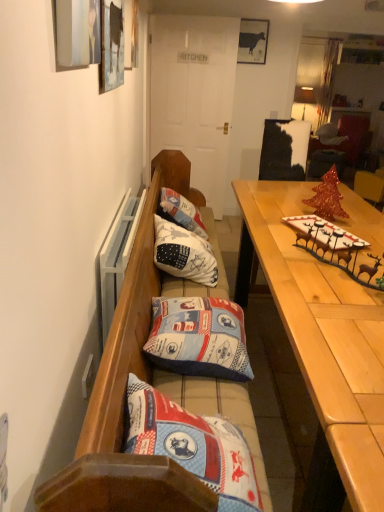
Question: From the image's perspective, is white cotton cushion at center, the first pillow from the back, positioned above or below matte black cow at upper center?

Choices:
 (A) above
 (B) below

Answer: (B)

Question: Looking at the image, does white cotton cushion at center, which appears as the 2th pillow when viewed from the front, seem bigger or smaller compared to matte black cow at upper center?

Choices:
 (A) small
 (B) big

Answer: (B)

Question: Which of these objects is positioned farthest from the matte black cabinet at upper right?

Choices:
 (A) matte black cow at upper center
 (B) wooden bench with cushions at center
 (C) light wood table at right
 (D) blue fabric pillow at center, which appears as the 1th pillow when ordered from the bottom
 (E) white cotton cushion at center, which appears as the 2th pillow when viewed from the front

Answer: (D)

Question: Which is farther from the matte black cabinet at upper right?

Choices:
 (A) blue fabric pillow at center, the 1th pillow from the front
 (B) matte black cow at upper center
 (C) wooden bench with cushions at center
 (D) light wood table at right
 (E) white cotton cushion at center, which is the 2th pillow in bottom-to-top order

Answer: (A)